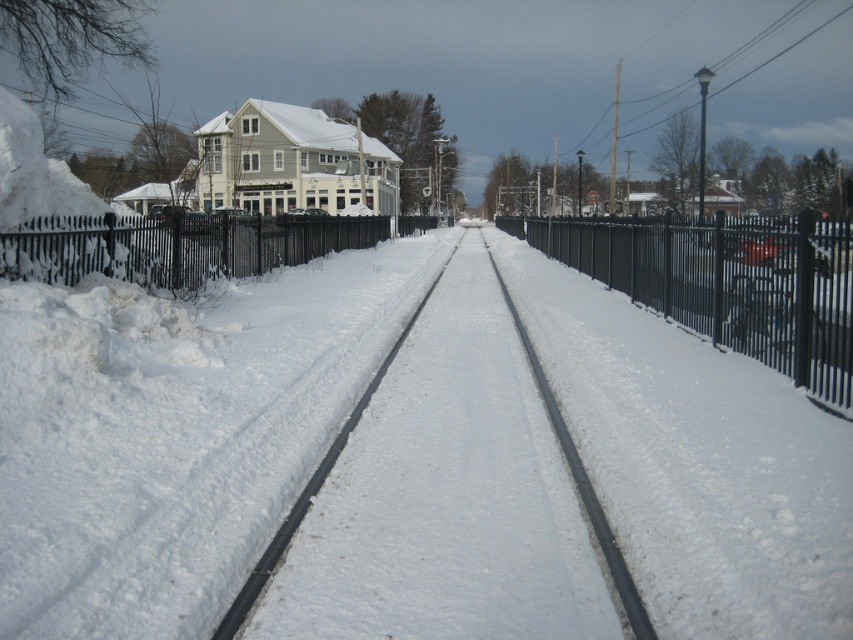
Question: Which object appears farthest from the camera in this image?

Choices:
 (A) black metal fence at center
 (B) snow-covered metal tracks at center
 (C) black wrought iron fence at left

Answer: (C)

Question: Which point is closer to the camera?

Choices:
 (A) pyautogui.click(x=215, y=248)
 (B) pyautogui.click(x=589, y=273)

Answer: (A)

Question: Is black metal fence at center bigger than black wrought iron fence at left?

Choices:
 (A) yes
 (B) no

Answer: (A)

Question: Does snow-covered metal tracks at center appear over black metal fence at center?

Choices:
 (A) no
 (B) yes

Answer: (A)

Question: Which point is farther to the camera?

Choices:
 (A) (422, 385)
 (B) (831, 257)

Answer: (A)

Question: Does black metal fence at center have a larger size compared to black wrought iron fence at left?

Choices:
 (A) yes
 (B) no

Answer: (A)